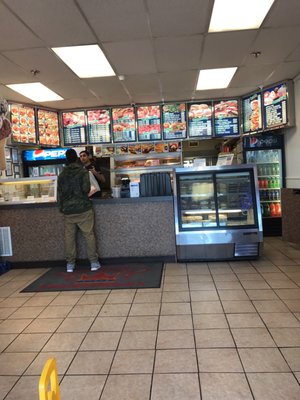
Identify the location of ceiling. (137, 50).